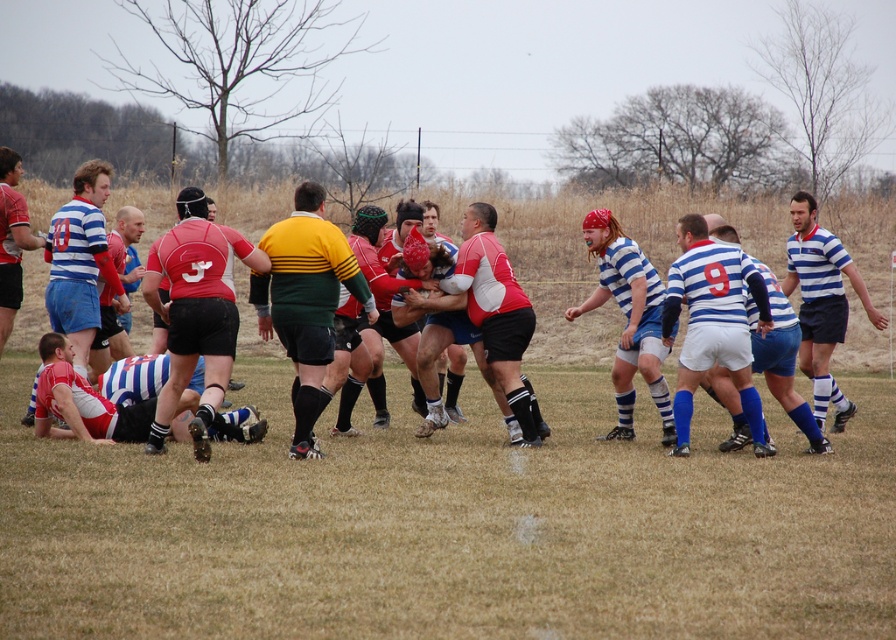
Question: In this image, where is blue striped jersey at center located relative to matte red rugby jersey at lower left?

Choices:
 (A) below
 (B) above

Answer: (B)

Question: Is yellow-green jersey at center above blue striped jersey at center?

Choices:
 (A) yes
 (B) no

Answer: (A)

Question: Can you confirm if matte red rugby ball at center is positioned below matte red rugby jersey at lower left?

Choices:
 (A) no
 (B) yes

Answer: (A)

Question: Which of the following is the closest to the observer?

Choices:
 (A) matte red rugby ball at center
 (B) matte red rugby jersey at lower left
 (C) matte red jersey at center
 (D) yellow-green jersey at center

Answer: (D)

Question: Which object is closer to the camera taking this photo?

Choices:
 (A) yellow-green jersey at center
 (B) blue striped jersey at right

Answer: (A)

Question: Estimate the real-world distances between objects in this image. Which object is farther from the matte red rugby jersey at lower left?

Choices:
 (A) matte red rugby ball at center
 (B) blue striped jersey at right

Answer: (A)